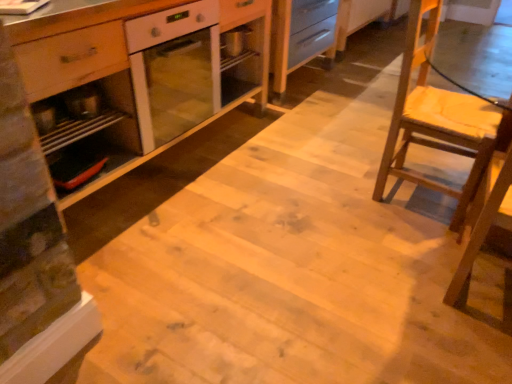
The image size is (512, 384). What do you see at coordinates (120, 61) in the screenshot?
I see `white glossy oven at center` at bounding box center [120, 61].

At what (x,y) coordinates should I click in order to perform the action: click on white glossy oven at center. Please return your answer as a coordinate pair (x, y). The height and width of the screenshot is (384, 512). Looking at the image, I should click on (120, 61).

Which object is closer to the camera, metallic silver tray at left or wooden chair at right?

Positioned in front is wooden chair at right.

Find the location of `chair below the metallic silver tray at left (from a real-world perspective)`. chair below the metallic silver tray at left (from a real-world perspective) is located at coordinates (437, 118).

What's the angular difference between metallic silver tray at left and wooden chair at right's facing directions?

0.13 degrees.

From the image's perspective, which object appears higher, metallic silver tray at left or wooden chair at right?

wooden chair at right.

Does metallic silver tray at left appear on the left side of white glossy oven at center?

Indeed, metallic silver tray at left is positioned on the left side of white glossy oven at center.

Are metallic silver tray at left and white glossy oven at center far apart?

Actually, metallic silver tray at left and white glossy oven at center are a little close together.

Is metallic silver tray at left positioned with its back to white glossy oven at center?

Correct, metallic silver tray at left is looking away from white glossy oven at center.

From the image's perspective, is metallic silver tray at left on white glossy oven at center?

No, from the image's perspective, metallic silver tray at left is not on top of white glossy oven at center.

Considering the relative sizes of white glossy oven at center and wooden chair at right in the image provided, is white glossy oven at center smaller than wooden chair at right?

No.

From the image's perspective, which one is positioned lower, white glossy oven at center or wooden chair at right?

wooden chair at right, from the image's perspective.

Does point (83, 79) come behind point (402, 89)?

No, it is in front of (402, 89).

Are white glossy oven at center and wooden chair at right far apart?

Yes.

Based on the photo, is wooden chair at right taller than metallic silver tray at left?

Yes, wooden chair at right is taller than metallic silver tray at left.

Considering the sizes of wooden chair at right and metallic silver tray at left in the image, is wooden chair at right wider or thinner than metallic silver tray at left?

wooden chair at right is wider than metallic silver tray at left.

Can you confirm if wooden chair at right is smaller than metallic silver tray at left?

No.

Find the location of a particular element. chair beneath the metallic silver tray at left (from a real-world perspective) is located at coordinates (437, 118).

Is point (435, 185) positioned in front of point (264, 29)?

Yes, it is in front of point (264, 29).

In the scene shown: Can you confirm if wooden chair at right is shorter than white glossy oven at center?

In fact, wooden chair at right may be taller than white glossy oven at center.

Is wooden chair at right beside white glossy oven at center?

wooden chair at right is not next to white glossy oven at center, and they're not touching.

Is wooden chair at right in front of white glossy oven at center?

No, wooden chair at right is behind white glossy oven at center.

Does white glossy oven at center have a smaller size compared to metallic silver tray at left?

Incorrect, white glossy oven at center is not smaller in size than metallic silver tray at left.

From the image's perspective, is white glossy oven at center under metallic silver tray at left?

Incorrect, from the image's perspective, white glossy oven at center is higher than metallic silver tray at left.

In the scene shown: Is white glossy oven at center at the right side of metallic silver tray at left?

Yes.

The image size is (512, 384). Identify the location of chair in front of the metallic silver tray at left. [x=437, y=118].

Find the location of a particular element. cabinetry that appears below the metallic silver tray at left (from a real-world perspective) is located at coordinates (120, 61).

From the image, which object appears to be nearer to white glossy oven at center, metallic silver tray at left or wooden chair at right?

metallic silver tray at left is closer to white glossy oven at center.

Based on the photo, which object lies nearer to the anchor point metallic silver tray at left, white glossy oven at center or wooden chair at right?

The object closer to metallic silver tray at left is white glossy oven at center.

Based on the photo, which object lies nearer to the anchor point wooden chair at right, white glossy oven at center or metallic silver tray at left?

white glossy oven at center is closer to wooden chair at right.

When comparing their distances from wooden chair at right, does metallic silver tray at left or white glossy oven at center seem closer?

white glossy oven at center is closer to wooden chair at right.

When comparing their distances from white glossy oven at center, does wooden chair at right or metallic silver tray at left seem further?

Among the two, wooden chair at right is located further to white glossy oven at center.

Estimate the real-world distances between objects in this image. Which object is closer to metallic silver tray at left, wooden chair at right or white glossy oven at center?

Among the two, white glossy oven at center is located nearer to metallic silver tray at left.

Locate an element on the screen. cabinetry between metallic silver tray at left and wooden chair at right from left to right is located at coordinates (120, 61).